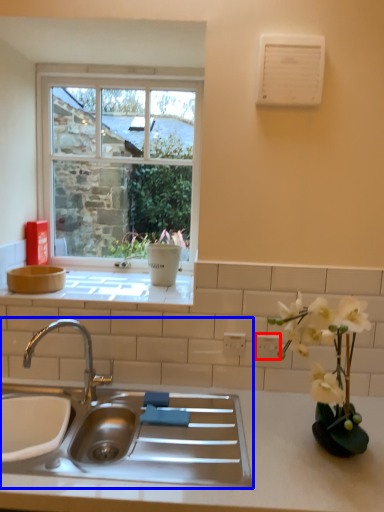
Question: Among these objects, which one is nearest to the camera, electric outlet (highlighted by a red box) or sink (highlighted by a blue box)?

Choices:
 (A) electric outlet
 (B) sink

Answer: (B)